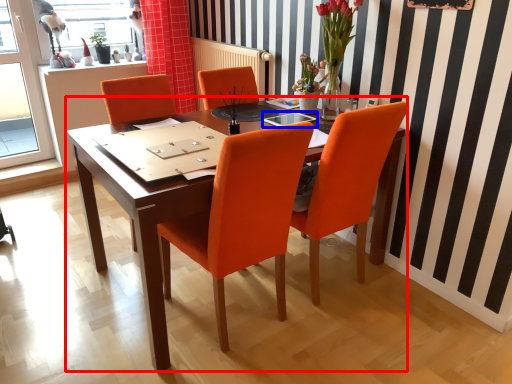
Question: Which point is closer to the camera, desk (highlighted by a red box) or glass table (highlighted by a blue box)?

Choices:
 (A) desk
 (B) glass table

Answer: (A)